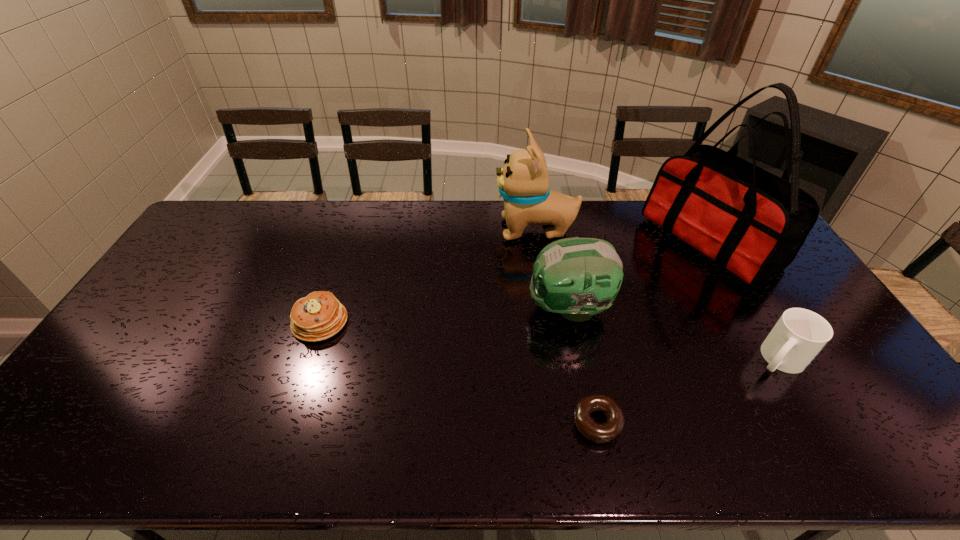
The height and width of the screenshot is (540, 960). In order to click on free region that satisfies the following two spatial constraints: 1. on the back side of the mug; 2. on the visor of the third tallest object in this screenshot , I will do `click(749, 308)`.

Locate an element on the screen. free space that satisfies the following two spatial constraints: 1. on the back side of the nearest object; 2. on the left side of the mug is located at coordinates (585, 359).

You are a GUI agent. You are given a task and a screenshot of the screen. Output one action in this format:
    pyautogui.click(x=<x>, y=<y>)
    Task: Click on the vacant point that satisfies the following two spatial constraints: 1. on the front side of the leftmost object; 2. on the right side of the third shortest object
    
    Given the screenshot: What is the action you would take?
    pyautogui.click(x=307, y=359)